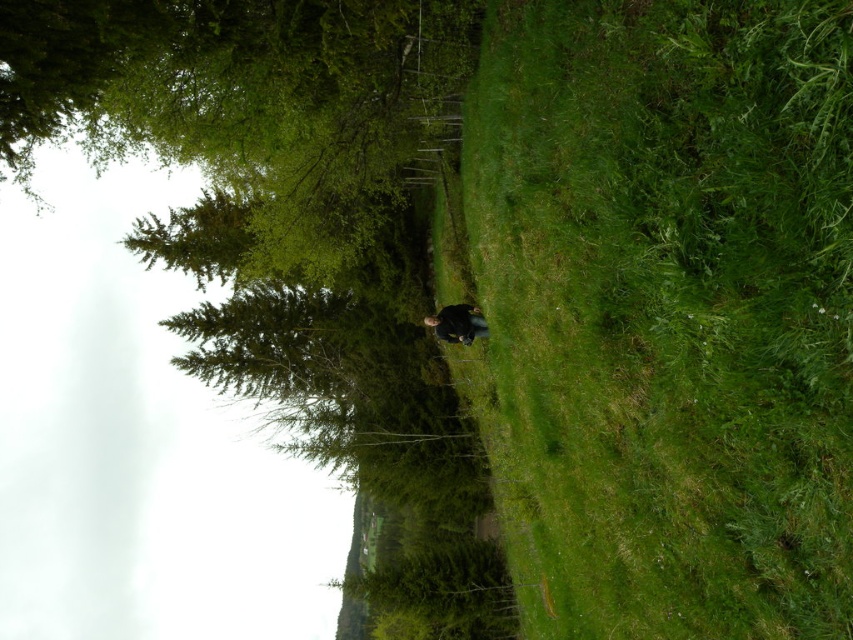
You are standing at the point marked as point (668, 310) in the image. What is the immediate surface you are standing on?

The immediate surface at point (668, 310) is green grassy at center.

You are planning to set up a picnic area in the scene. Considering the green grassy at center and the green leafy tree at upper left, which area would provide more space for spreading out a picnic blanket?

The green leafy tree at upper left provides more space for spreading out a picnic blanket because its width is greater than the green grassy at center.

You are standing in the outdoor scene and want to take a photo of the dark blue jacket at center. To ensure the green grassy at center is not blocking the view, should you move forward or backward?

The green grassy at center is in front of the dark blue jacket at center, so to avoid blocking the view, you should move backward to get a clearer shot of the dark blue jacket at center.